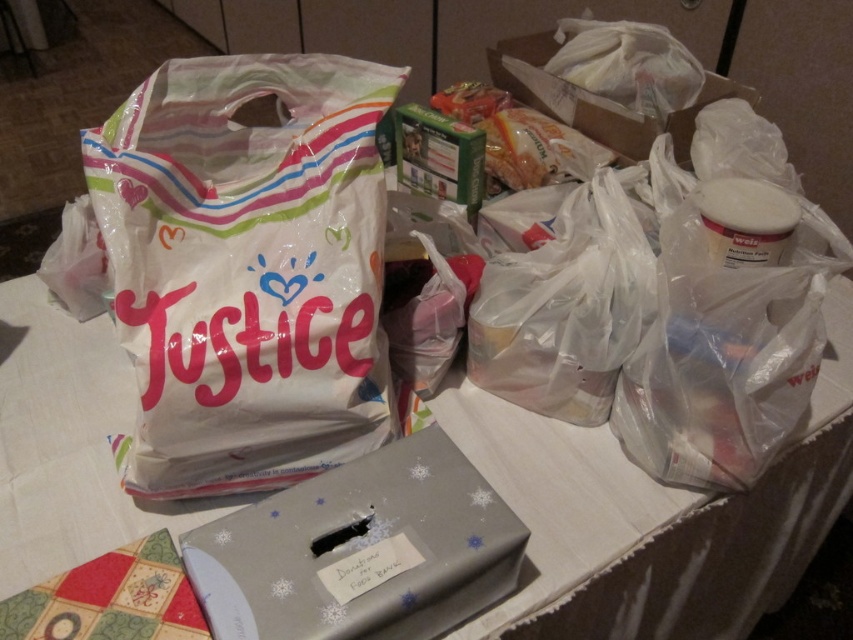
Is white plastic bag at left in front of silver paper box at lower center?

No, white plastic bag at left is further to the viewer.

Does point (126, 230) come farther from viewer compared to point (439, 448)?

Yes, point (126, 230) is behind point (439, 448).

The height and width of the screenshot is (640, 853). What are the coordinates of `white plastic bag at left` in the screenshot? It's located at (247, 268).

I want to click on white plastic bag at left, so click(x=247, y=268).

Is white plastic bag at left below translucent plastic bag at upper right?

Indeed, white plastic bag at left is positioned under translucent plastic bag at upper right.

Which is in front, point (187, 424) or point (679, 122)?

Point (187, 424)

What are the coordinates of `white plastic bag at left` in the screenshot? It's located at (247, 268).

Can you confirm if white plastic bag at left is positioned to the right of white paper bag at upper left?

No, white plastic bag at left is not to the right of white paper bag at upper left.

Is white plastic bag at left to the left of white paper bag at upper left from the viewer's perspective?

Correct, you'll find white plastic bag at left to the left of white paper bag at upper left.

Locate an element on the screen. The width and height of the screenshot is (853, 640). white plastic bag at left is located at coordinates (247, 268).

Where is `white plastic bag at left`? white plastic bag at left is located at coordinates (247, 268).